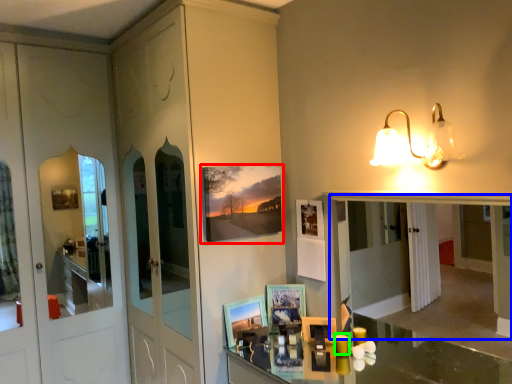
Question: Estimate the real-world distances between objects in this image. Which object is farther from picture frame (highlighted by a red box), mirror (highlighted by a blue box) or candle (highlighted by a green box)?

Choices:
 (A) mirror
 (B) candle

Answer: (A)